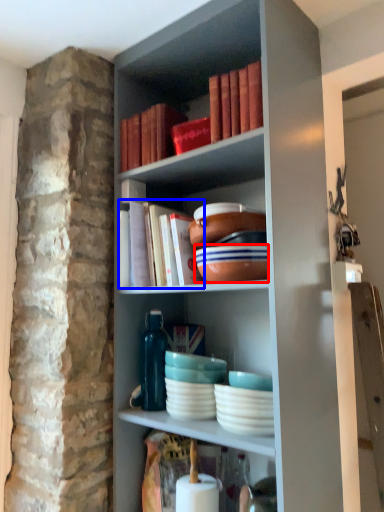
Question: Which point is closer to the camera, bowl (highlighted by a red box) or book (highlighted by a blue box)?

Choices:
 (A) bowl
 (B) book

Answer: (A)